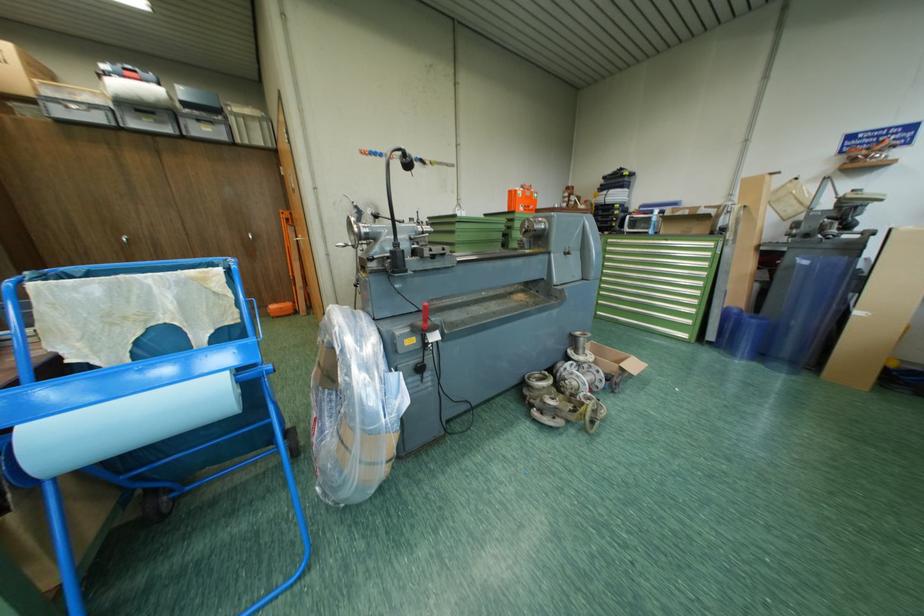
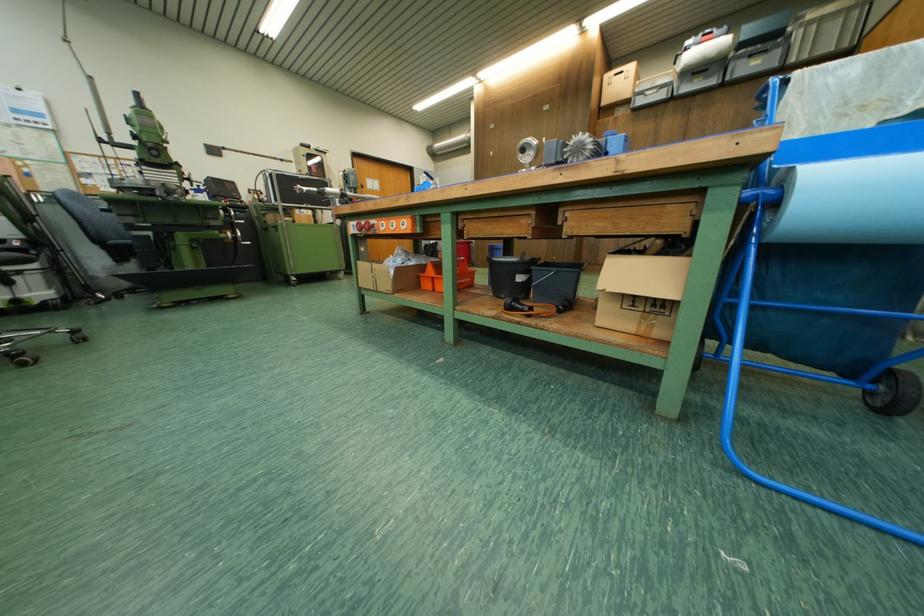
Question: How did the camera likely rotate?

Choices:
 (A) Left
 (B) Right
 (C) Up
 (D) Down

Answer: (A)